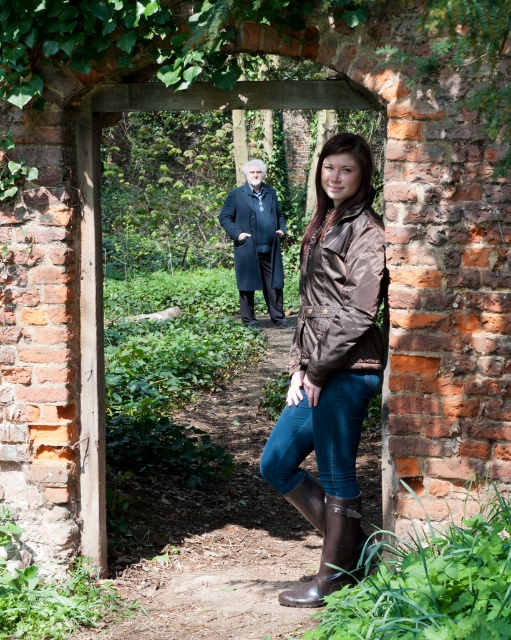
Question: Which object is farther from the camera taking this photo?

Choices:
 (A) brown satin jacket at center
 (B) dark blue wool coat at center
 (C) brown leather jacket at center

Answer: (B)

Question: Can you confirm if brown satin jacket at center is positioned above brown leather jacket at center?

Choices:
 (A) yes
 (B) no

Answer: (B)

Question: Can you confirm if brown leather jacket at center is positioned to the right of brown rubber boot at lower center?

Choices:
 (A) no
 (B) yes

Answer: (A)

Question: Which of these objects is positioned farthest from the brown rubber boot at lower center?

Choices:
 (A) brown satin jacket at center
 (B) dark blue wool coat at center

Answer: (B)

Question: Does brown satin jacket at center have a lesser width compared to brown leather jacket at center?

Choices:
 (A) yes
 (B) no

Answer: (B)

Question: Among these objects, which one is farthest from the camera?

Choices:
 (A) dark blue wool coat at center
 (B) brown rubber boot at lower center
 (C) brown leather jacket at center

Answer: (A)